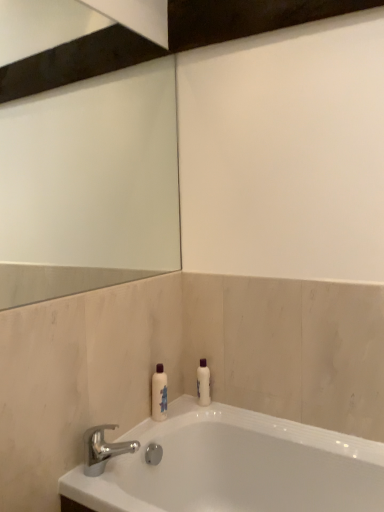
Find the location of a particular element. Image resolution: width=384 pixels, height=512 pixels. silver metallic faucet at lower left is located at coordinates (103, 449).

Identify the location of white glossy bottle at center. (159, 394).

Where is `white glossy bathtub at lower center`? white glossy bathtub at lower center is located at coordinates (235, 466).

Considering the sizes of objects white glossy bottle at center and silver metallic faucet at lower left in the image provided, who is smaller, white glossy bottle at center or silver metallic faucet at lower left?

white glossy bottle at center.

Is white glossy bottle at center outside of silver metallic faucet at lower left?

Yes, white glossy bottle at center is located beyond the bounds of silver metallic faucet at lower left.

From a real-world perspective, is white glossy bottle at center positioned over silver metallic faucet at lower left based on gravity?

Yes.

Is silver metallic faucet at lower left at the back of white glossy bottle at center?

No, white glossy bottle at center is not facing the opposite direction of silver metallic faucet at lower left.

Which of these two, white glossy bottle at center or white glossy bathtub at lower center, stands taller?

With more height is white glossy bathtub at lower center.

Between white glossy bottle at center and white glossy bathtub at lower center, which one has larger size?

Bigger between the two is white glossy bathtub at lower center.

From a real-world perspective, who is located higher, white glossy bottle at center or white glossy bathtub at lower center?

white glossy bottle at center.

Can you tell me how much white glossy bottle at center and white glossy bathtub at lower center differ in facing direction?

There is a 90.8-degree angle between the facing directions of white glossy bottle at center and white glossy bathtub at lower center.

Is white glossy bathtub at lower center wider or thinner than silver metallic faucet at lower left?

white glossy bathtub at lower center is wider than silver metallic faucet at lower left.

From the image's perspective, does white glossy bathtub at lower center appear lower than silver metallic faucet at lower left?

Yes, from the image's perspective, white glossy bathtub at lower center is below silver metallic faucet at lower left.

Measure the distance between white glossy bathtub at lower center and silver metallic faucet at lower left.

A distance of 33.59 centimeters exists between white glossy bathtub at lower center and silver metallic faucet at lower left.

From a real-world perspective, which is physically above, white glossy bathtub at lower center or silver metallic faucet at lower left?

In real-world perspective, silver metallic faucet at lower left is above.

Considering the sizes of objects silver metallic faucet at lower left and white glossy bottle at center in the image provided, who is bigger, silver metallic faucet at lower left or white glossy bottle at center?

With larger size is silver metallic faucet at lower left.

What's the angular difference between silver metallic faucet at lower left and white glossy bottle at center's facing directions?

0.00261 degrees.

In terms of height, does silver metallic faucet at lower left look taller or shorter compared to white glossy bottle at center?

Clearly, silver metallic faucet at lower left is shorter compared to white glossy bottle at center.

Looking at this image, from a real-world perspective, is silver metallic faucet at lower left physically below white glossy bottle at center?

Yes, from a real-world perspective, silver metallic faucet at lower left is below white glossy bottle at center.

Is there a large distance between silver metallic faucet at lower left and white glossy bathtub at lower center?

No, silver metallic faucet at lower left is not far from white glossy bathtub at lower center.

Is silver metallic faucet at lower left bigger than white glossy bathtub at lower center?

No.

In the scene shown: What's the angular difference between silver metallic faucet at lower left and white glossy bathtub at lower center's facing directions?

90.8 degrees.

Who is taller, silver metallic faucet at lower left or white glossy bathtub at lower center?

Standing taller between the two is white glossy bathtub at lower center.

Consider the image. Can you see white glossy bathtub at lower center touching white glossy bottle at center?

They are not placed beside each other.

From a real-world perspective, is white glossy bathtub at lower center on top of white glossy bottle at center?

Incorrect, from a real-world perspective, white glossy bathtub at lower center is lower than white glossy bottle at center.

Can you tell me how much white glossy bathtub at lower center and white glossy bottle at center differ in facing direction?

90.8 degrees separate the facing orientations of white glossy bathtub at lower center and white glossy bottle at center.

You are a GUI agent. You are given a task and a screenshot of the screen. Output one action in this format:
    pyautogui.click(x=<x>, y=<y>)
    Task: Click on the tap in front of the white glossy bottle at center
    The image size is (384, 512).
    Given the screenshot: What is the action you would take?
    pyautogui.click(x=103, y=449)

The width and height of the screenshot is (384, 512). I want to click on toiletry positioned vertically above the white glossy bathtub at lower center (from a real-world perspective), so click(x=159, y=394).

In the scene shown: When comparing their distances from silver metallic faucet at lower left, does white glossy bathtub at lower center or white glossy bottle at center seem further?

white glossy bathtub at lower center lies further to silver metallic faucet at lower left than the other object.

Considering their positions, is white glossy bottle at center positioned further to white glossy bathtub at lower center than silver metallic faucet at lower left?

silver metallic faucet at lower left is further to white glossy bathtub at lower center.

Considering their positions, is white glossy bathtub at lower center positioned further to white glossy bottle at center than silver metallic faucet at lower left?

white glossy bathtub at lower center lies further to white glossy bottle at center than the other object.

Which object lies nearer to the anchor point silver metallic faucet at lower left, white glossy bottle at center or white glossy bathtub at lower center?

white glossy bottle at center lies closer to silver metallic faucet at lower left than the other object.

Which object lies further to the anchor point white glossy bottle at center, silver metallic faucet at lower left or white glossy bathtub at lower center?

white glossy bathtub at lower center lies further to white glossy bottle at center than the other object.

When comparing their distances from white glossy bathtub at lower center, does silver metallic faucet at lower left or white glossy bottle at center seem closer?

Based on the image, white glossy bottle at center appears to be nearer to white glossy bathtub at lower center.

What are the coordinates of `tap located between white glossy bathtub at lower center and white glossy bottle at center in the depth direction` in the screenshot? It's located at (103, 449).